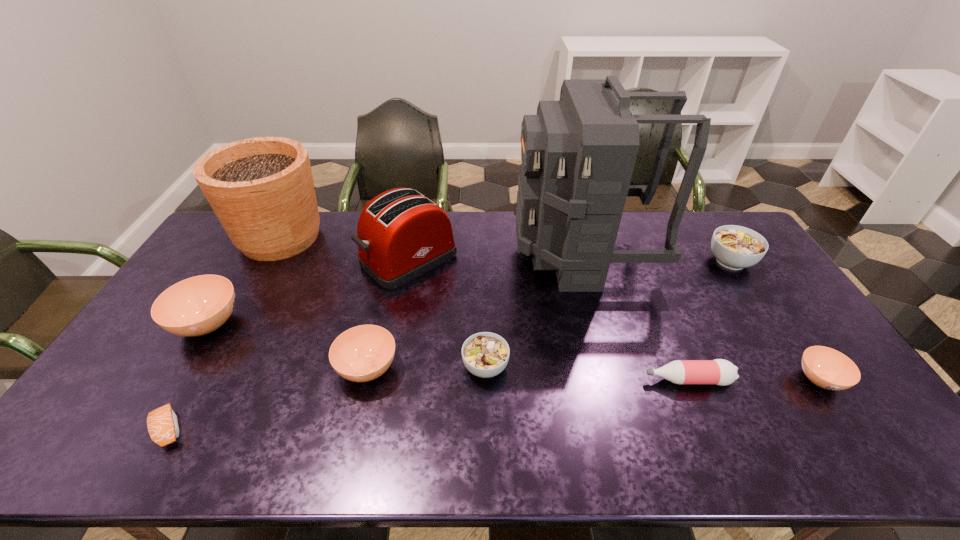
What are the coordinates of `the tallest object` in the screenshot? It's located at (578, 154).

Locate an element on the screen. gray backpack is located at coordinates (578, 154).

Find the location of a particular element. the ninth shortest object is located at coordinates (261, 189).

The width and height of the screenshot is (960, 540). Find the location of `the eighth shortest object`. the eighth shortest object is located at coordinates (401, 234).

Identify the location of toaster. (401, 234).

Identify the location of the biggest peach soup bowl. Image resolution: width=960 pixels, height=540 pixels. (199, 305).

Locate an element on the screen. The image size is (960, 540). the leftmost soup bowl is located at coordinates (199, 305).

Where is `the right white soup bowl`? The image size is (960, 540). the right white soup bowl is located at coordinates (735, 247).

Locate an element on the screen. This screenshot has width=960, height=540. the bigger white soup bowl is located at coordinates (735, 247).

Identify the location of the second biggest peach soup bowl. (363, 353).